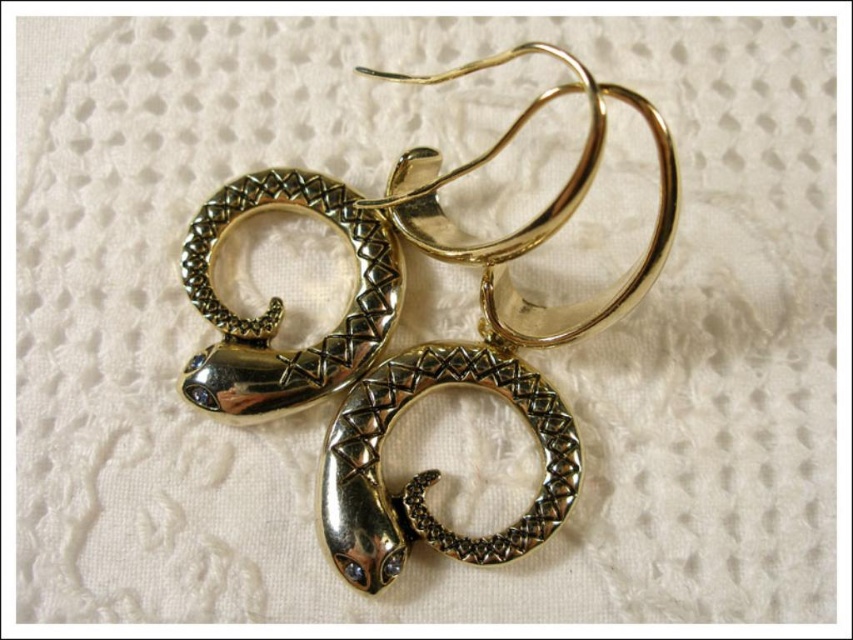
Question: Is gold textured snake at center to the right of gold/metallic snake at center from the viewer's perspective?

Choices:
 (A) yes
 (B) no

Answer: (A)

Question: In this image, where is gold textured snake at center located relative to gold/metallic snake at center?

Choices:
 (A) above
 (B) below

Answer: (B)

Question: Which point appears farthest from the camera in this image?

Choices:
 (A) (363, 372)
 (B) (422, 381)

Answer: (A)

Question: Which object appears closest to the camera in this image?

Choices:
 (A) gold/metallic snake at center
 (B) gold textured snake at center

Answer: (B)

Question: Does gold textured snake at center appear on the right side of gold/metallic snake at center?

Choices:
 (A) no
 (B) yes

Answer: (B)

Question: Which point is closer to the camera?

Choices:
 (A) gold/metallic snake at center
 (B) gold textured snake at center

Answer: (B)